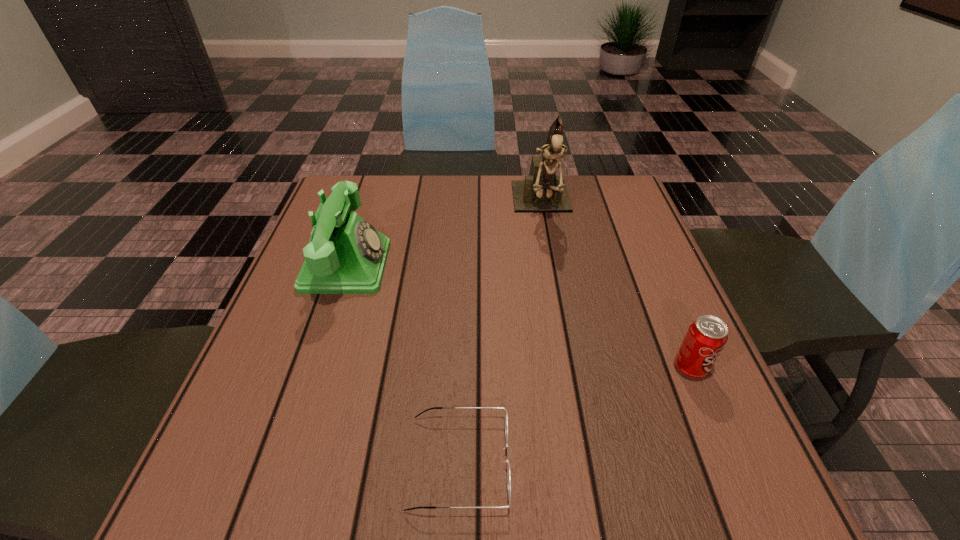
Where is `free region that satisfies the following two spatial constraints: 1. on the dial of the second shortest object; 2. on the right side of the telephone`? free region that satisfies the following two spatial constraints: 1. on the dial of the second shortest object; 2. on the right side of the telephone is located at coordinates (313, 368).

Find the location of `vacant region that satisfies the following two spatial constraints: 1. on the front-facing side of the second object from right to left; 2. on the right side of the second shortest object`. vacant region that satisfies the following two spatial constraints: 1. on the front-facing side of the second object from right to left; 2. on the right side of the second shortest object is located at coordinates (572, 368).

You are a GUI agent. You are given a task and a screenshot of the screen. Output one action in this format:
    pyautogui.click(x=<x>, y=<y>)
    Task: Click on the free space that satisfies the following two spatial constraints: 1. on the front-facing side of the figurine; 2. on the dial of the telephone
    The image size is (960, 540).
    Given the screenshot: What is the action you would take?
    pyautogui.click(x=553, y=266)